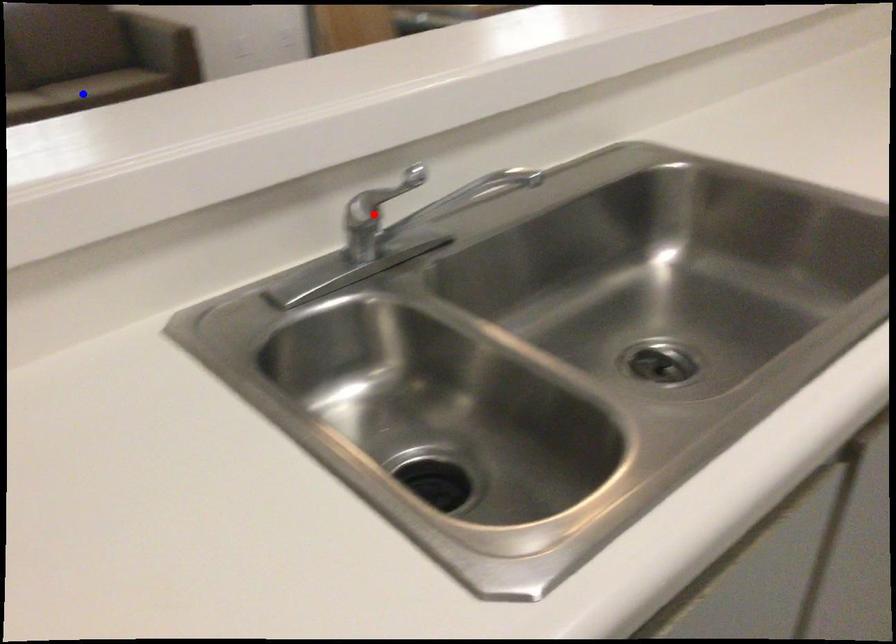
Question: In the image, two points are highlighted. Which point is nearer to the camera? Reply with the corresponding letter.

Choices:
 (A) blue point
 (B) red point

Answer: (B)